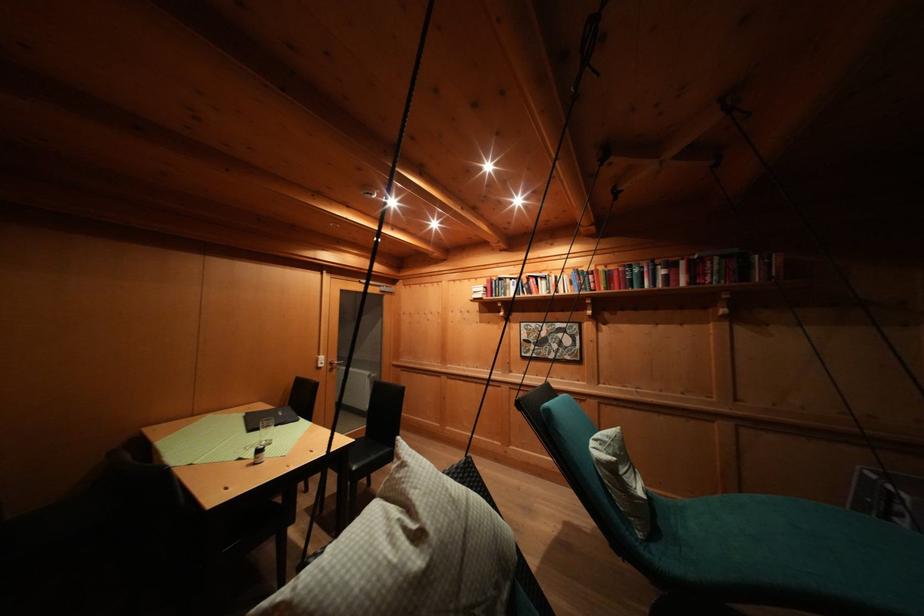
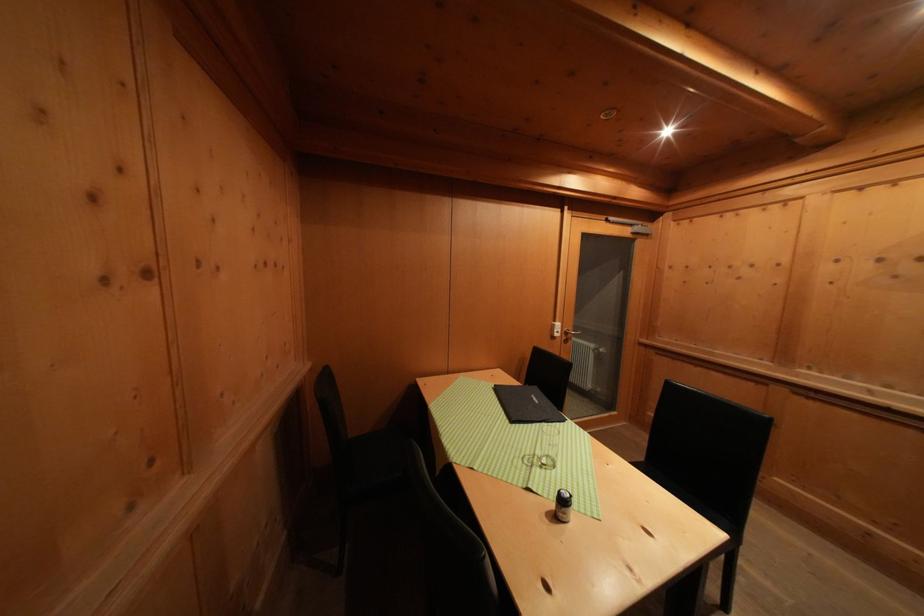
The point at (x=327, y=362) is marked in the first image. Where is the corresponding point in the second image?

(564, 330)